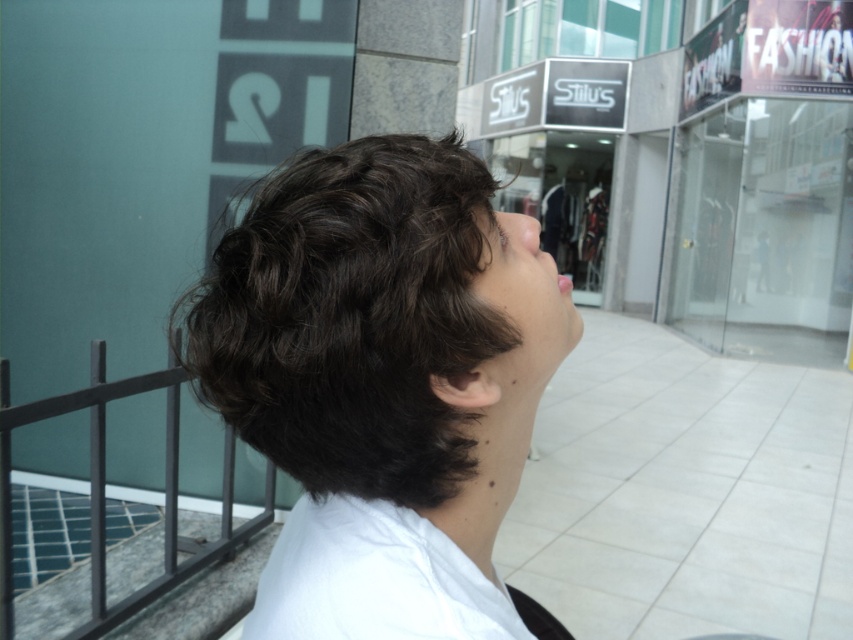
Question: Does white cotton shirt at center have a larger size compared to smooth skin face at center?

Choices:
 (A) no
 (B) yes

Answer: (B)

Question: Which is farther from the smooth skin face at center?

Choices:
 (A) white cotton shirt at center
 (B) dark curly hair at center
 (C) black metal balustrade at lower left

Answer: (C)

Question: Which object is positioned farthest from the smooth skin face at center?

Choices:
 (A) white cotton shirt at center
 (B) dark curly hair at center

Answer: (A)

Question: Does dark curly hair at center appear under black metal balustrade at lower left?

Choices:
 (A) no
 (B) yes

Answer: (A)

Question: Which object is the closest to the black metal balustrade at lower left?

Choices:
 (A) smooth skin face at center
 (B) white cotton shirt at center
 (C) dark curly hair at center

Answer: (C)

Question: Does dark curly hair at center appear over white cotton shirt at center?

Choices:
 (A) no
 (B) yes

Answer: (B)